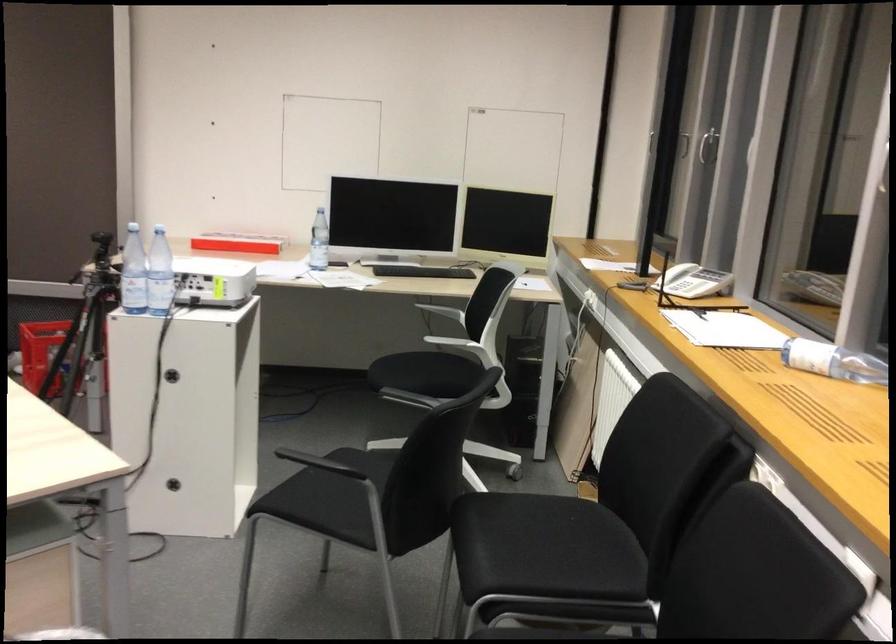
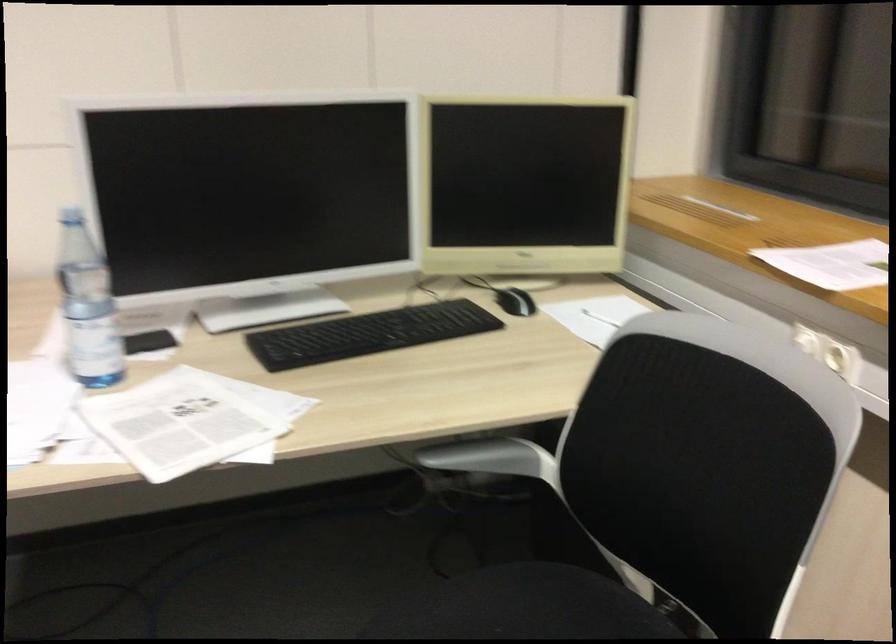
Question: What movement of the cameraman would produce the second image?

Choices:
 (A) Left
 (B) Right
 (C) Forward
 (D) Backward

Answer: (C)